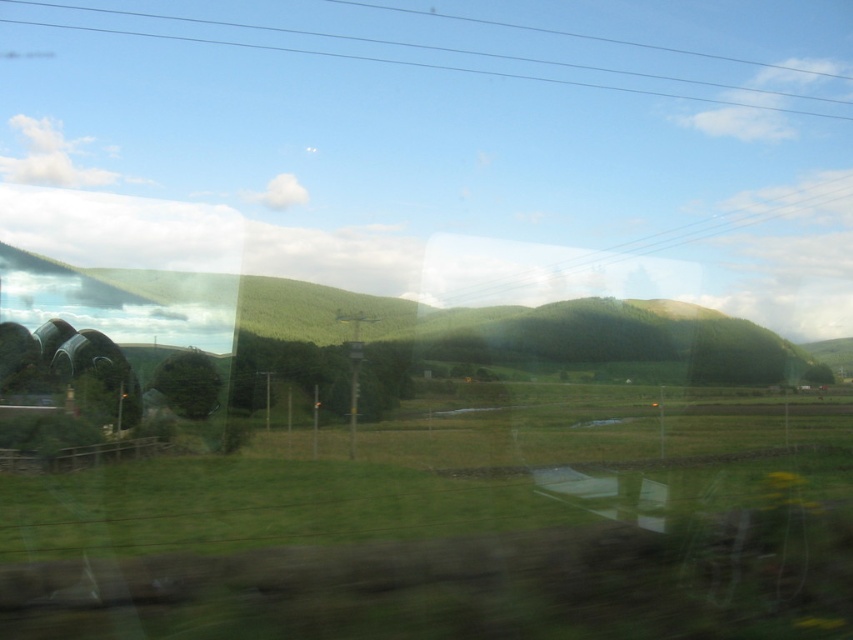
Who is shorter, green grassy field at center or green matte tree at center?

With less height is green matte tree at center.

Locate an element on the screen. green grassy field at center is located at coordinates (444, 474).

Does point (529, 500) lie in front of point (671, 355)?

Yes, it is.

Which is behind, point (706, 476) or point (668, 317)?

Positioned behind is point (668, 317).

This screenshot has width=853, height=640. Identify the location of green grassy field at center. (444, 474).

Does green grassy field at center appear on the right side of clear blue wires at upper center?

Correct, you'll find green grassy field at center to the right of clear blue wires at upper center.

The width and height of the screenshot is (853, 640). What are the coordinates of `green grassy field at center` in the screenshot? It's located at (444, 474).

Which is behind, point (33, 545) or point (596, 83)?

Positioned behind is point (596, 83).

You are a GUI agent. You are given a task and a screenshot of the screen. Output one action in this format:
    pyautogui.click(x=<x>, y=<y>)
    Task: Click on the green grassy field at center
    
    Given the screenshot: What is the action you would take?
    pyautogui.click(x=444, y=474)